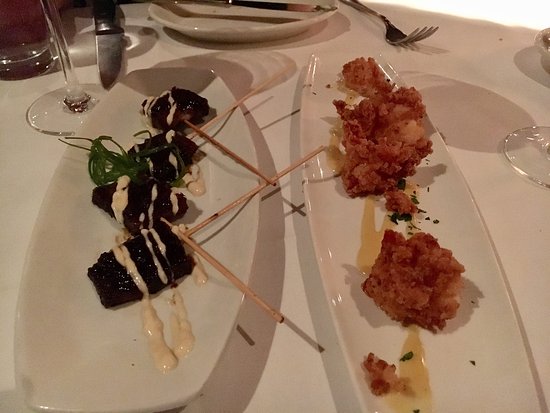
This screenshot has width=550, height=413. Identify the location of white table cloth. (456, 140).